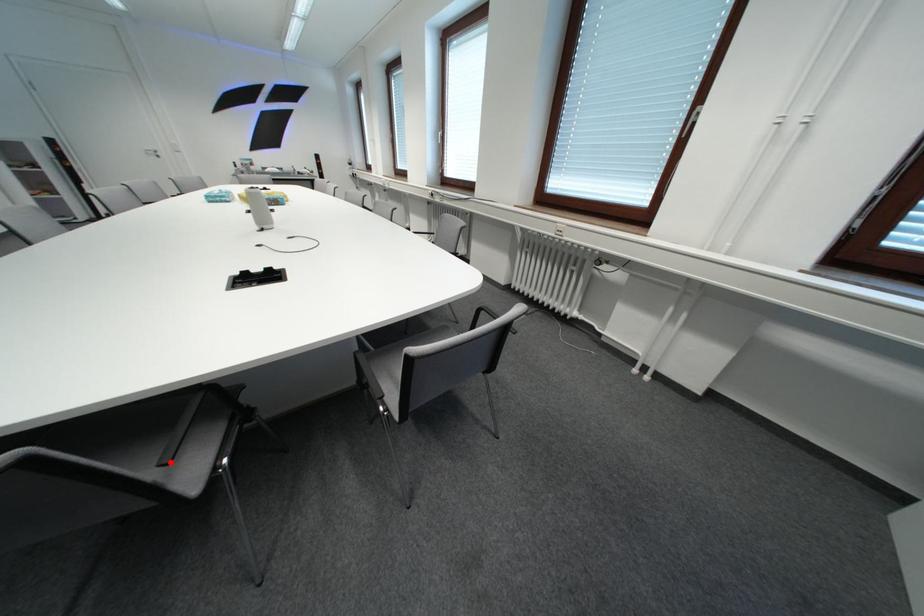
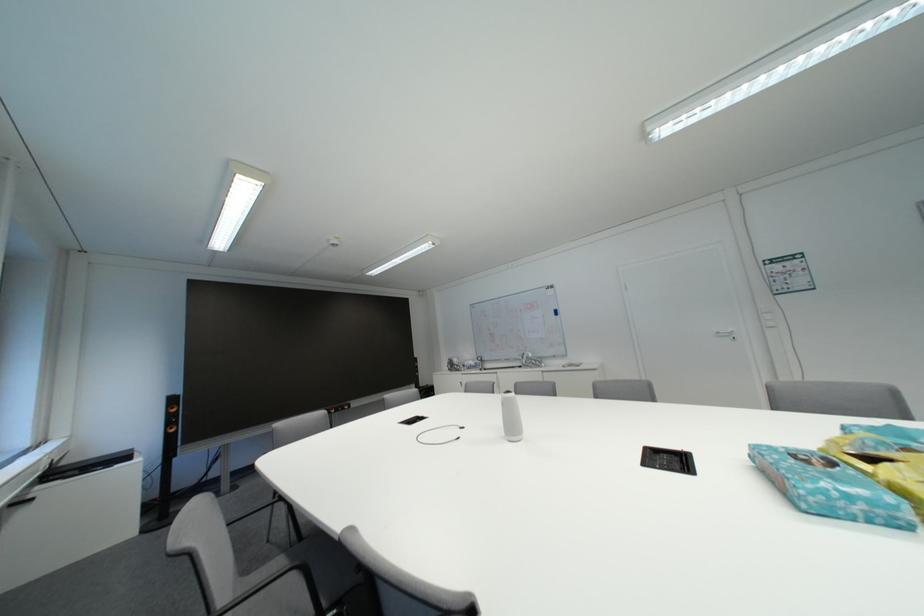
Question: I am providing you with two images of the same scene from different viewpoints. A red point is marked on the first image. Can you still see the location of the red point in image 2?

Choices:
 (A) Yes
 (B) No

Answer: (B)